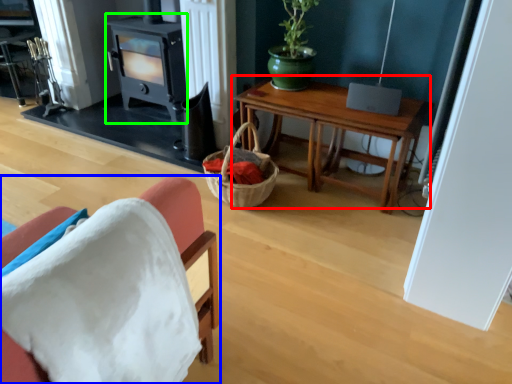
Question: Which object is positioned closest to table (highlighted by a red box)? Select from chair (highlighted by a blue box) and fireplace (highlighted by a green box).

Choices:
 (A) chair
 (B) fireplace

Answer: (B)